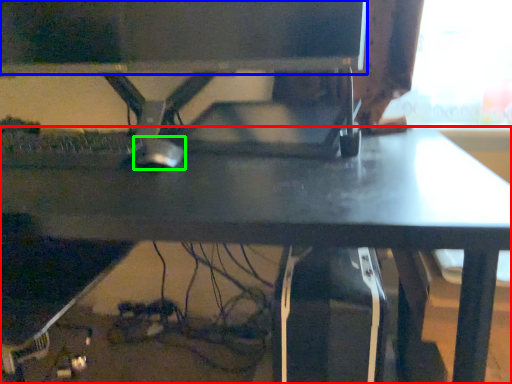
Question: Which object is positioned closest to desk (highlighted by a red box)? Select from computer monitor (highlighted by a blue box) and mouse (highlighted by a green box).

Choices:
 (A) computer monitor
 (B) mouse

Answer: (B)